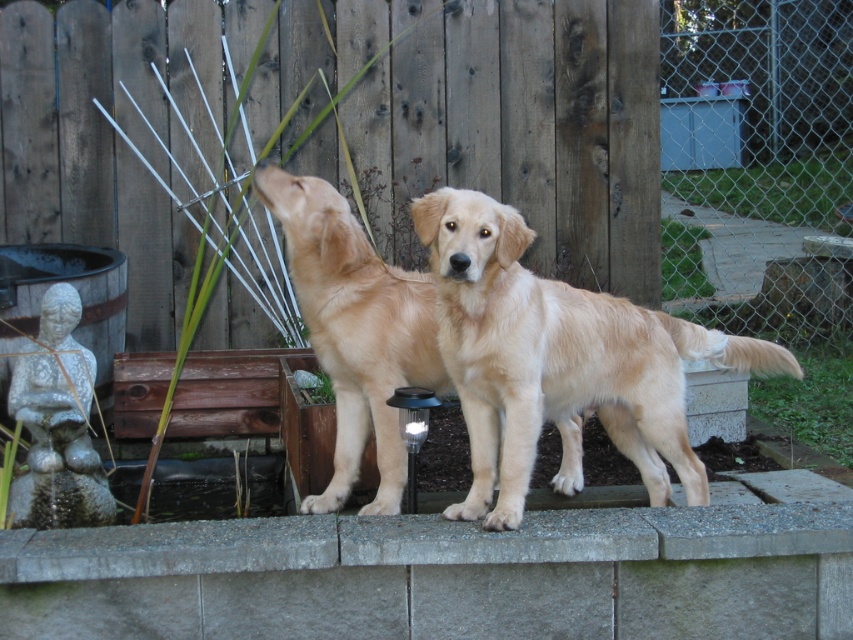
Question: Among these points, which one is farthest from the camera?

Choices:
 (A) (285, 221)
 (B) (851, 493)

Answer: (B)

Question: In this image, where is golden retriever at center located relative to gray concrete ledge at center?

Choices:
 (A) right
 (B) left

Answer: (A)

Question: Which object appears closest to the camera in this image?

Choices:
 (A) wooden fence at center
 (B) gray concrete ledge at center

Answer: (B)

Question: Which point is closer to the camera?

Choices:
 (A) wooden fence at center
 (B) golden retriever at center

Answer: (B)

Question: Is golden retriever at center positioned behind golden fur dog at center?

Choices:
 (A) no
 (B) yes

Answer: (A)

Question: Can you confirm if gray concrete ledge at center is bigger than golden fur dog at center?

Choices:
 (A) no
 (B) yes

Answer: (A)